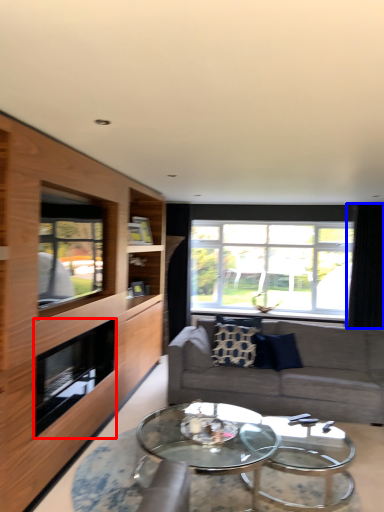
Question: Which object appears farthest to the camera in this image, fireplace (highlighted by a red box) or curtain (highlighted by a blue box)?

Choices:
 (A) fireplace
 (B) curtain

Answer: (B)